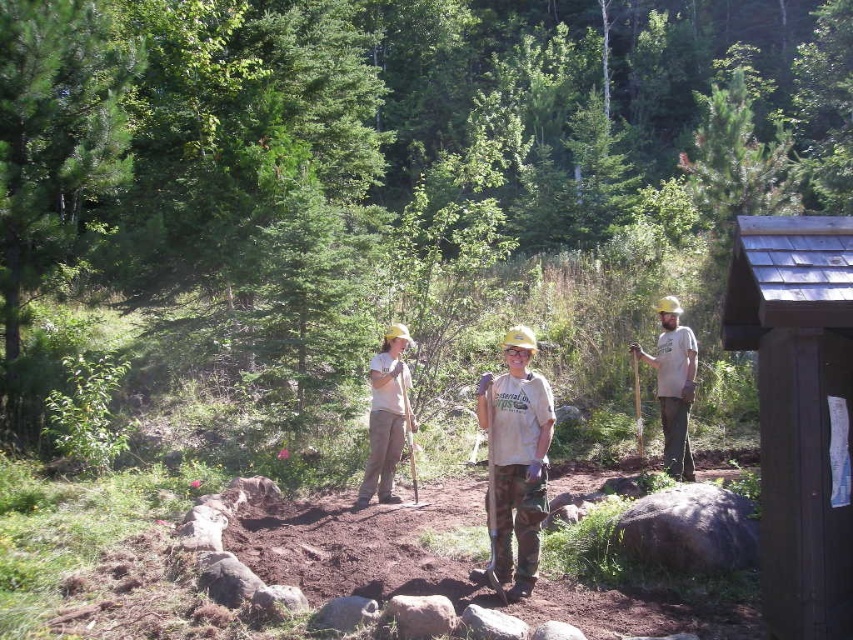
Based on the scene description, where is the wooden shingled hut at right located in the image?

The wooden shingled hut at right is located at point (798, 412) in the image.

You are a hiker who has just arrived at this wooded area. You see a wooden shingled hut at right and camouflage pants at center. Which object is positioned further to the right?

The wooden shingled hut at right is positioned further to the right than the camouflage pants at center.

Based on the provided scene description, where is the wooden shingled hut at right located in terms of its 2D coordinates?

The wooden shingled hut at right is located at the 2D coordinates point (x=798, y=412).